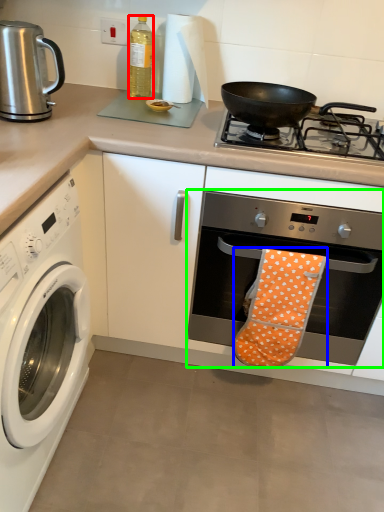
Question: Which is farther away from bottle (highlighted by a red box)? beach towel (highlighted by a blue box) or oven (highlighted by a green box)?

Choices:
 (A) beach towel
 (B) oven

Answer: (A)